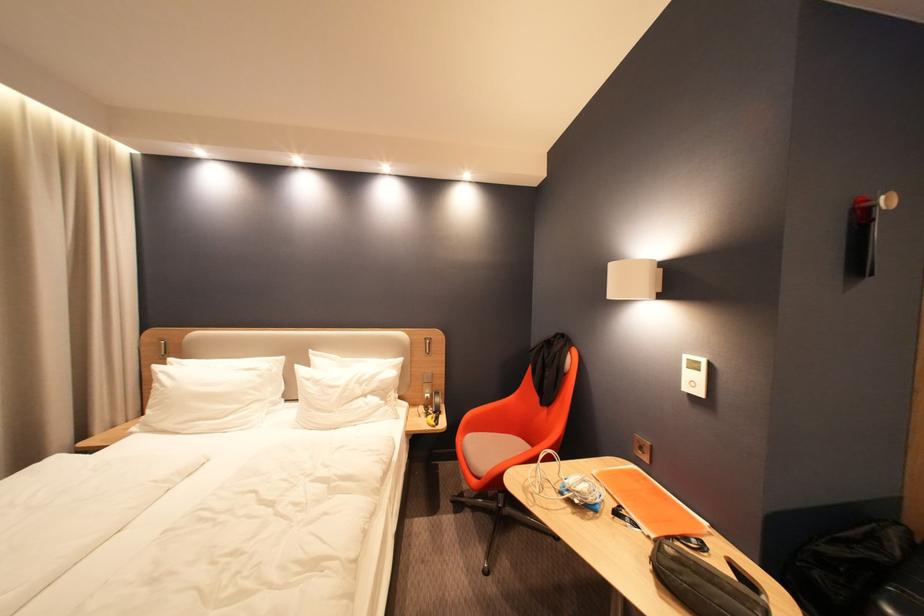
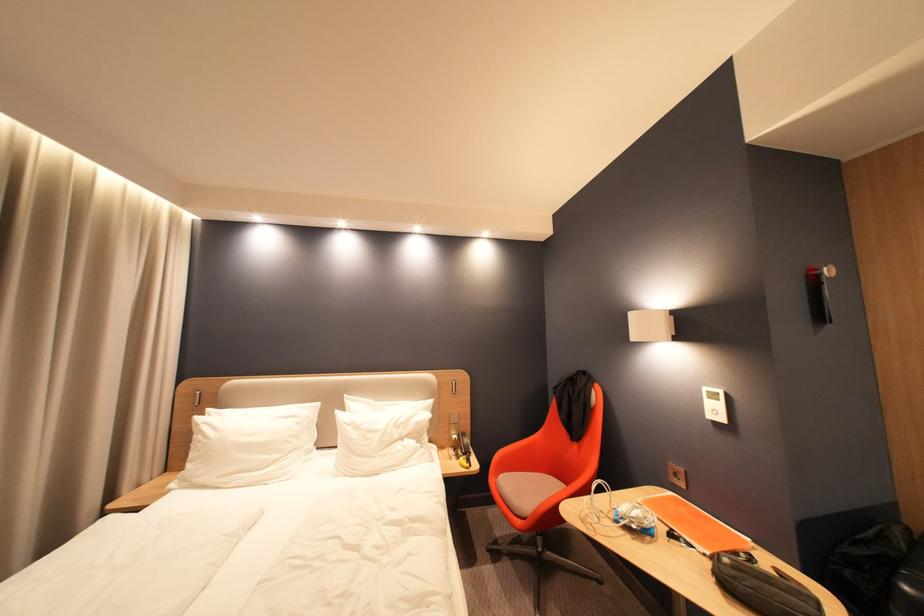
Find the pixel in the second image that matches the point at 172,373 in the first image.

(213, 424)